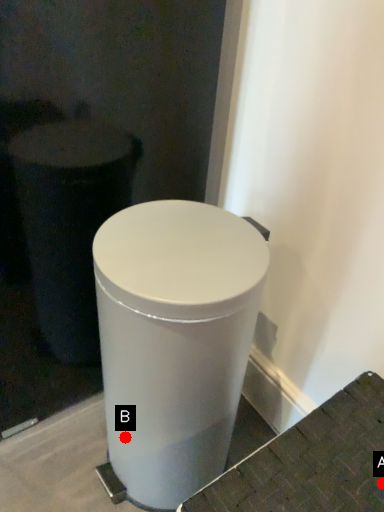
Question: Two points are circled on the image, labeled by A and B beside each circle. Which point is closer to the camera taking this photo?

Choices:
 (A) A is closer
 (B) B is closer

Answer: (A)